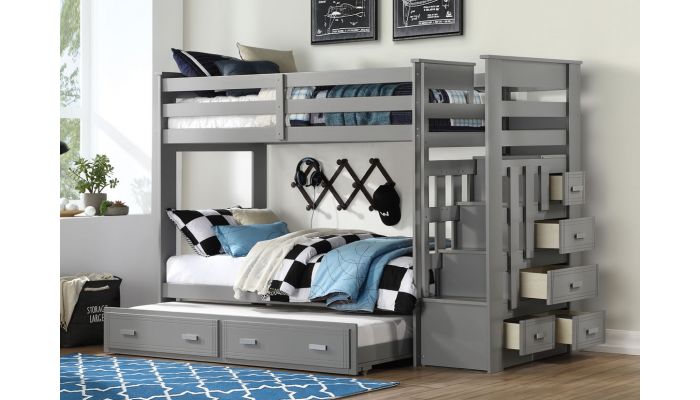
I want to click on drawer, so click(158, 334).